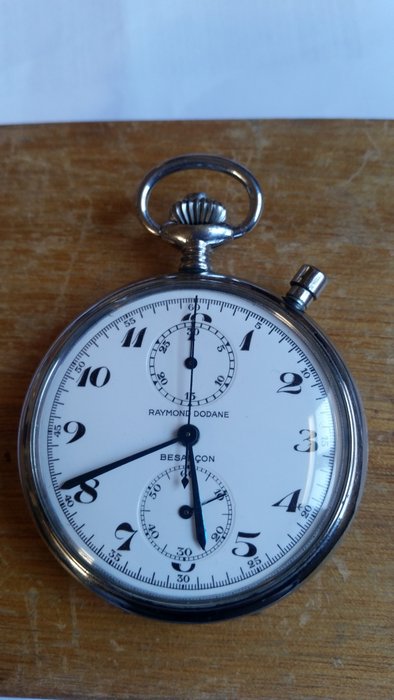
At what (x,y) coordinates should I click in order to perform the action: click on latch release. Please return your answer as a coordinate pair (x, y). This screenshot has height=700, width=394. Looking at the image, I should click on (201, 192).